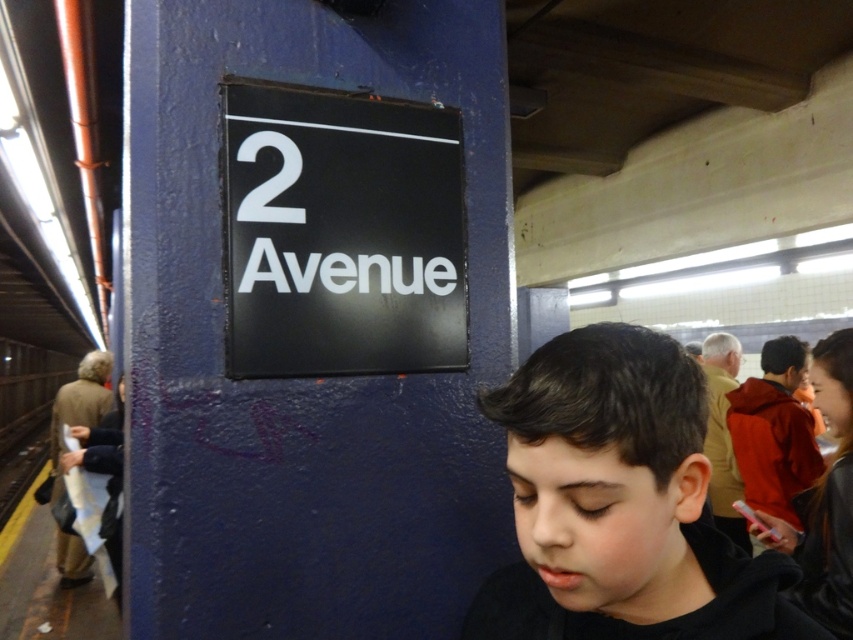
Question: Based on their relative distances, which object is farther from the black matte sign at center?

Choices:
 (A) white matte number at upper center
 (B) black matte hair at center

Answer: (B)

Question: Which is farther from the white matte number at upper center?

Choices:
 (A) black matte hair at center
 (B) black matte sign at center

Answer: (A)

Question: In this image, where is black matte hair at center located relative to white matte number at upper center?

Choices:
 (A) above
 (B) below

Answer: (B)

Question: Is black matte hair at center to the right of black matte sign at center from the viewer's perspective?

Choices:
 (A) no
 (B) yes

Answer: (B)

Question: Is black matte sign at center thinner than white matte number at upper center?

Choices:
 (A) yes
 (B) no

Answer: (B)

Question: Which of the following is the closest to the observer?

Choices:
 (A) (289, 150)
 (B) (822, 637)

Answer: (B)